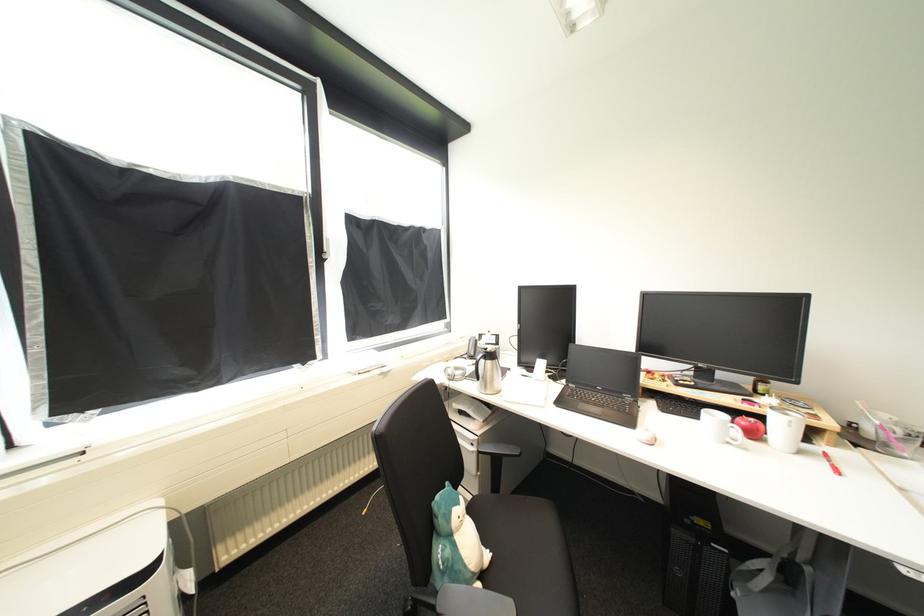
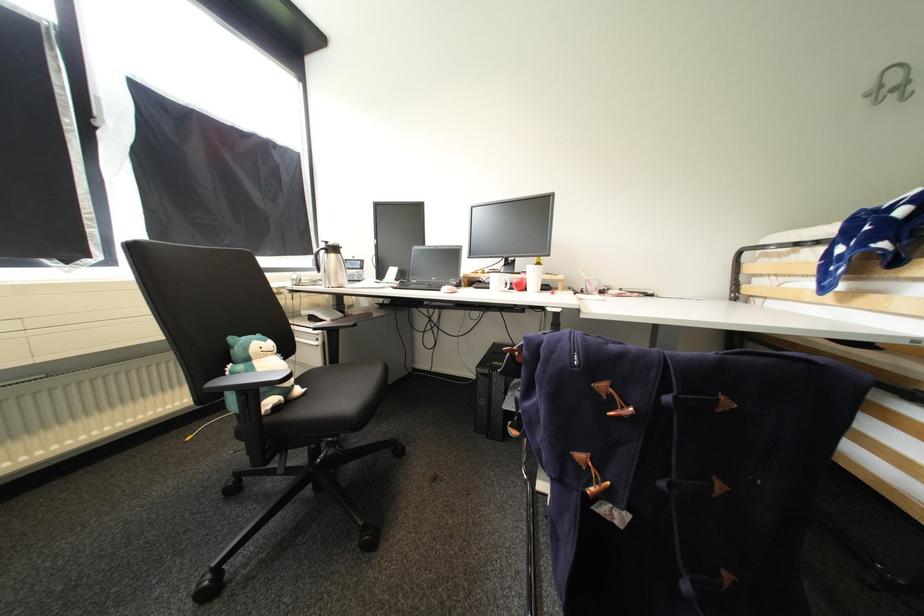
Locate, in the second image, the point that corresponds to point (493, 557) in the first image.

(306, 391)